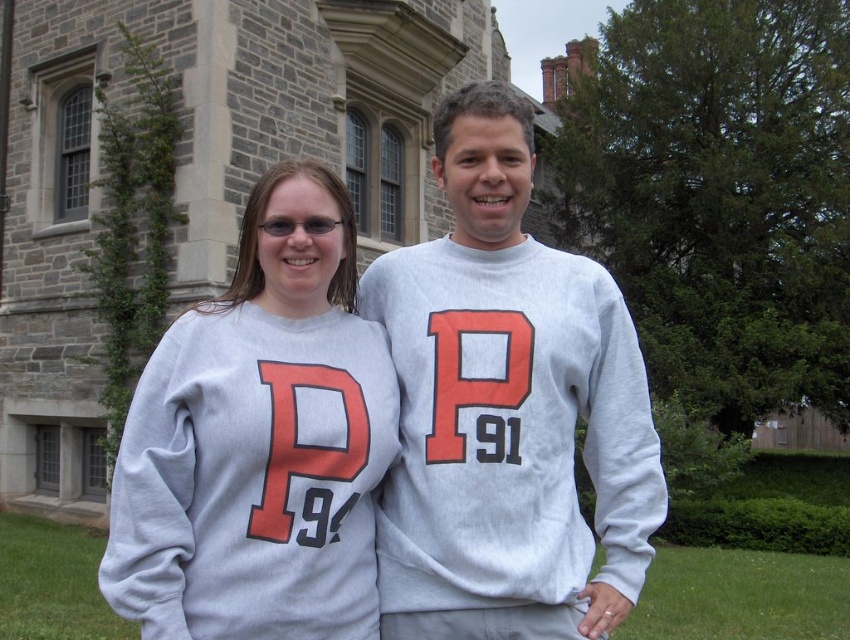
Does gray cotton sweatshirt at center appear on the left side of gray sweatshirt at center?

In fact, gray cotton sweatshirt at center is to the right of gray sweatshirt at center.

Is gray cotton sweatshirt at center wider than gray sweatshirt at center?

Yes, gray cotton sweatshirt at center is wider than gray sweatshirt at center.

Between point (565, 365) and point (327, 500), which one is positioned in front?

Point (327, 500) is more forward.

Where is `gray cotton sweatshirt at center`? The image size is (850, 640). gray cotton sweatshirt at center is located at coordinates (507, 410).